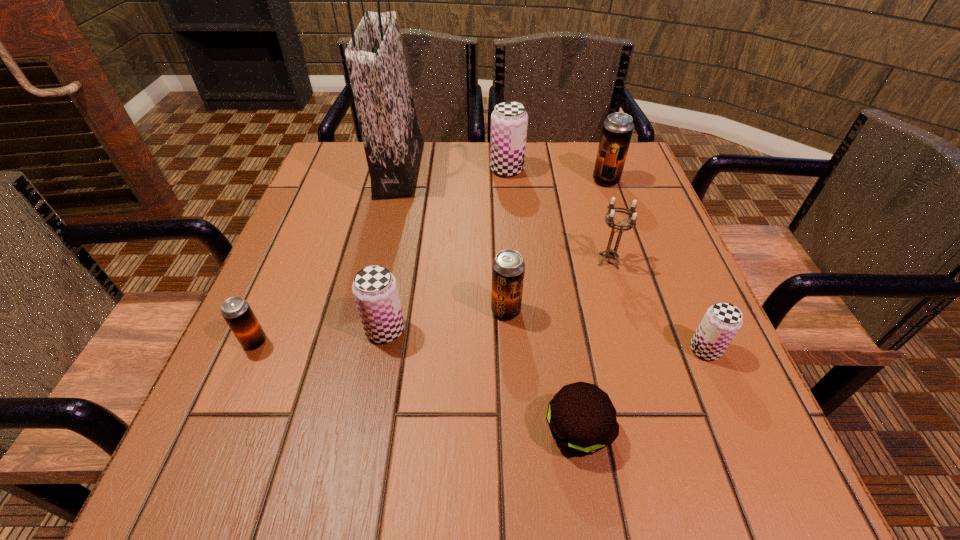
You are a GUI agent. You are given a task and a screenshot of the screen. Output one action in this format:
    pyautogui.click(x=<x>, y=<y>)
    Task: Click on the shopping bag
    Image resolution: width=960 pixels, height=540 pixels.
    Given the screenshot: What is the action you would take?
    pyautogui.click(x=393, y=144)

I want to click on the biggest black beer can, so click(617, 130).

Image resolution: width=960 pixels, height=540 pixels. I want to click on the fifth beer can from left to right, so click(x=617, y=130).

I want to click on the second purple beer can from left to right, so click(509, 120).

Find the location of `the farthest purple beer can`. the farthest purple beer can is located at coordinates (509, 120).

Image resolution: width=960 pixels, height=540 pixels. Find the location of `candle holder`. candle holder is located at coordinates (609, 253).

You are a GUI agent. You are given a task and a screenshot of the screen. Output one action in this format:
    pyautogui.click(x=<x>, y=<y>)
    Task: Click on the second beer can from left to right
    Image resolution: width=960 pixels, height=540 pixels.
    Given the screenshot: What is the action you would take?
    pyautogui.click(x=375, y=290)

You are a GUI agent. You are given a task and a screenshot of the screen. Output one action in this format:
    pyautogui.click(x=<x>, y=<y>)
    Task: Click on the leftmost purple beer can
    Image resolution: width=960 pixels, height=540 pixels.
    Given the screenshot: What is the action you would take?
    pyautogui.click(x=375, y=290)

At what (x,y) coordinates should I click in order to perform the action: click on the second biggest black beer can. Please return your answer as a coordinate pair (x, y). The width and height of the screenshot is (960, 540). Looking at the image, I should click on (508, 267).

Image resolution: width=960 pixels, height=540 pixels. I want to click on the second farthest black beer can, so click(508, 267).